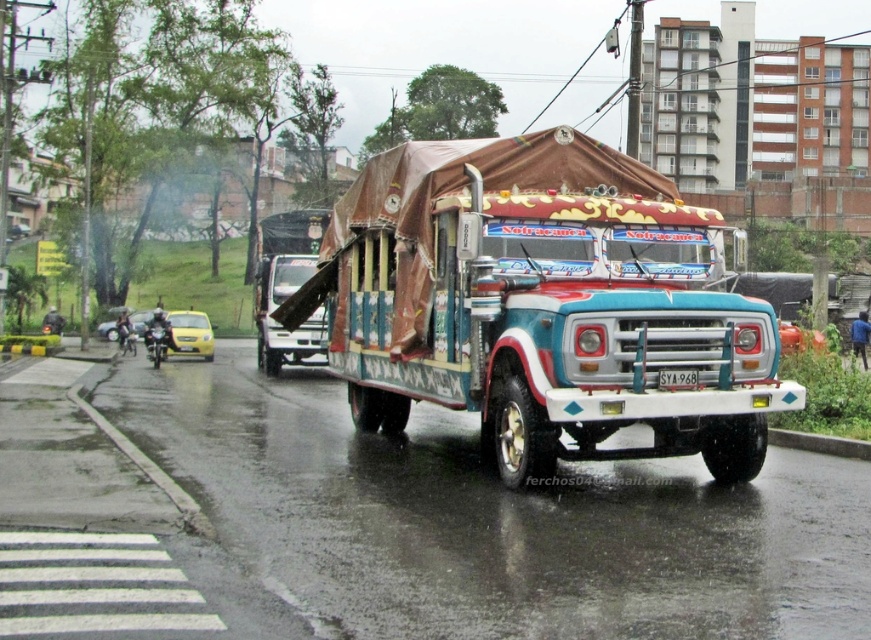
Question: Which point is farther to the camera?

Choices:
 (A) (463, 408)
 (B) (258, 296)

Answer: (B)

Question: Is painted wood truck at center positioned in front of wooden planks at center?

Choices:
 (A) yes
 (B) no

Answer: (A)

Question: Observing the image, what is the correct spatial positioning of painted wood truck at center in reference to wooden planks at center?

Choices:
 (A) above
 (B) below

Answer: (B)

Question: Does painted wood truck at center have a lesser width compared to wooden planks at center?

Choices:
 (A) no
 (B) yes

Answer: (B)

Question: Which of the following is the closest to the observer?

Choices:
 (A) wooden planks at center
 (B) painted wood truck at center

Answer: (B)

Question: Which point is farther from the camera taking this photo?

Choices:
 (A) (670, 285)
 (B) (296, 237)

Answer: (B)